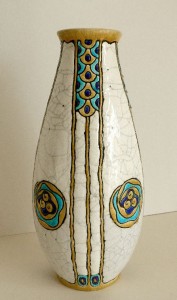
This screenshot has height=300, width=177. What are the coordinates of `neck of vase` in the screenshot? It's located at (98, 34).